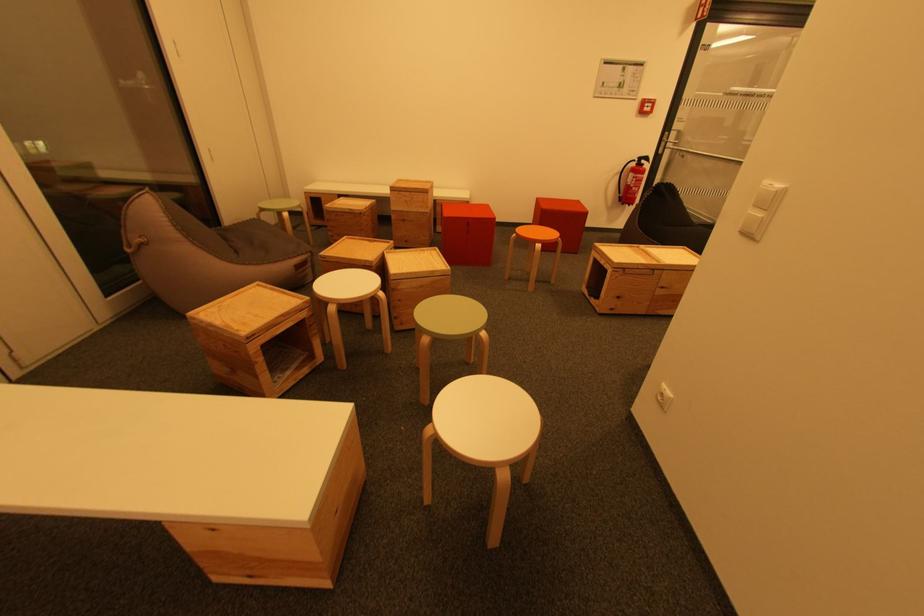
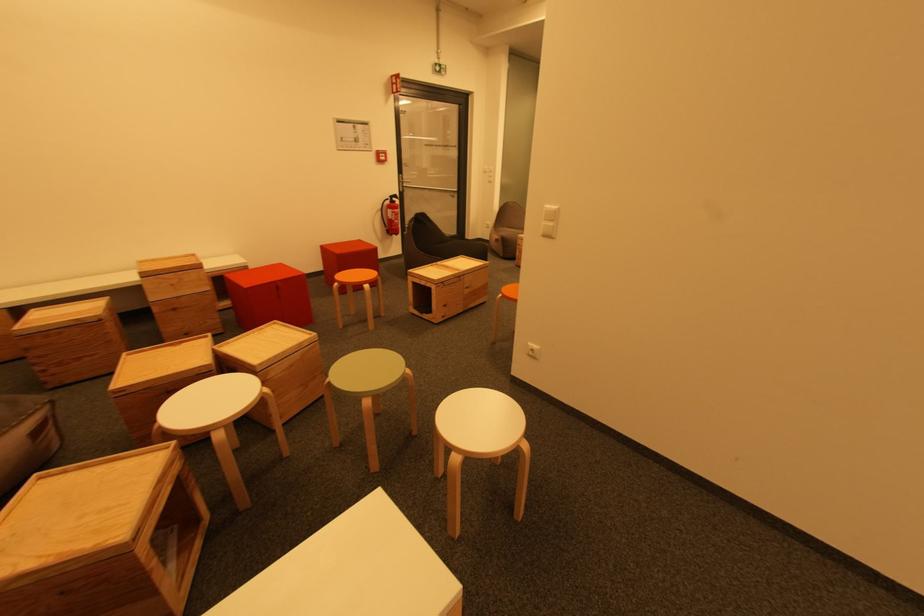
Question: The camera is either moving clockwise (left) or counter-clockwise (right) around the object. The first image is from the beginning of the video and the second image is from the end. Is the camera moving left or right when shooting the video?

Choices:
 (A) Left
 (B) Right

Answer: (A)